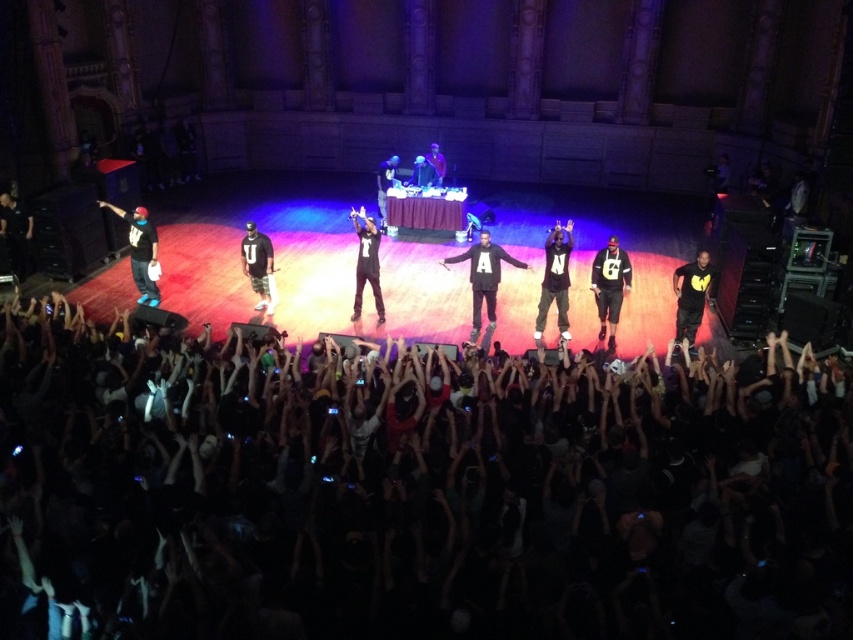
Between black matte shirt at right and black matte jacket at left, which one is positioned higher?

black matte jacket at left

Is black matte shirt at right wider than black matte jacket at left?

No, black matte shirt at right is not wider than black matte jacket at left.

This screenshot has height=640, width=853. Identify the location of black matte shirt at right. (691, 296).

Is point (550, 234) in front of point (387, 173)?

Yes, it is in front of point (387, 173).

Is black matte hoodie at center in front of matte black turntable at center?

That is True.

This screenshot has height=640, width=853. Find the location of `black matte hoodie at center`. black matte hoodie at center is located at coordinates (555, 280).

Can you confirm if white jersey at center is positioned to the right of black matte jacket at left?

Indeed, white jersey at center is positioned on the right side of black matte jacket at left.

Who is positioned more to the right, white jersey at center or black matte jacket at left?

white jersey at center is more to the right.

Who is more distant from viewer, (x=602, y=262) or (x=6, y=230)?

The point (x=6, y=230) is more distant.

Locate an element on the screen. white jersey at center is located at coordinates (608, 285).